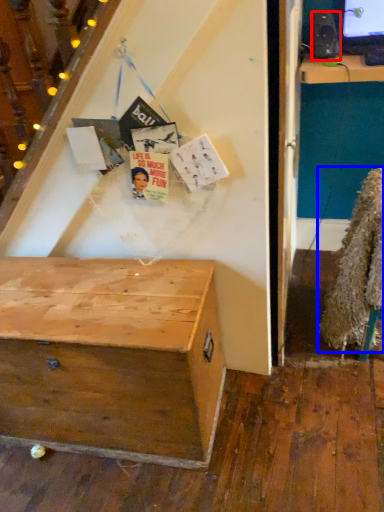
Question: Which point is further to the camera, loudspeaker (highlighted by a red box) or fur coat (highlighted by a blue box)?

Choices:
 (A) loudspeaker
 (B) fur coat

Answer: (A)